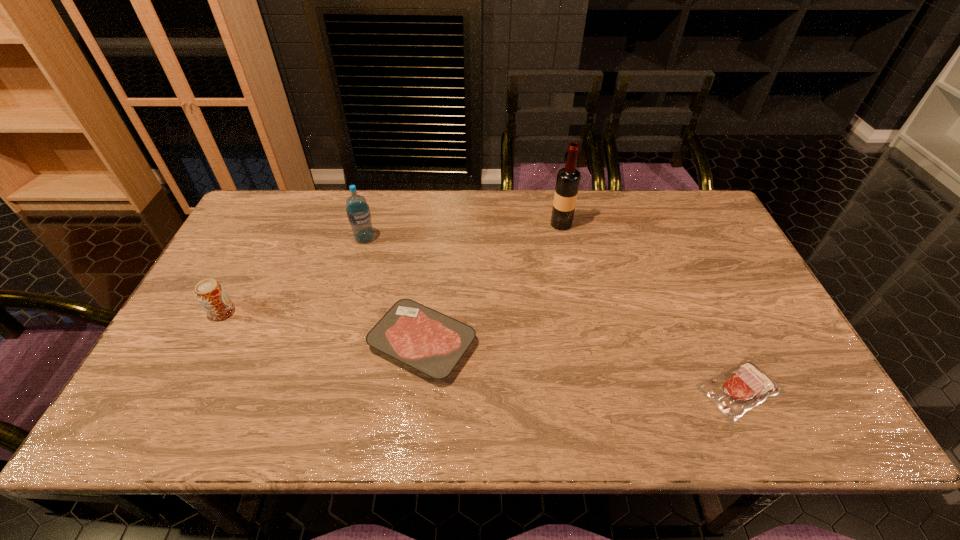
Find the location of `the fourth object from left to right`. the fourth object from left to right is located at coordinates (568, 179).

Image resolution: width=960 pixels, height=540 pixels. I want to click on the farthest object, so click(x=568, y=179).

Identify the location of the fourth shortest object. The image size is (960, 540). (358, 212).

You are a GUI agent. You are given a task and a screenshot of the screen. Output one action in this format:
    pyautogui.click(x=<x>, y=<y>)
    Task: Click on the second object from left to right
    This screenshot has height=540, width=960.
    Given the screenshot: What is the action you would take?
    pyautogui.click(x=358, y=212)

Locate an element on the screen. the leftmost object is located at coordinates (210, 293).

I want to click on beer can, so click(210, 293).

Where is `the second shortest object`? the second shortest object is located at coordinates (433, 343).

Locate an element on the screen. The height and width of the screenshot is (540, 960). the third object from left to right is located at coordinates (x=433, y=343).

The width and height of the screenshot is (960, 540). Identify the location of the shortest object. (734, 392).

At what (x,y) coordinates should I click in order to perform the action: click on the rightmost object. Please return your answer as a coordinate pair (x, y). Looking at the image, I should click on [x=734, y=392].